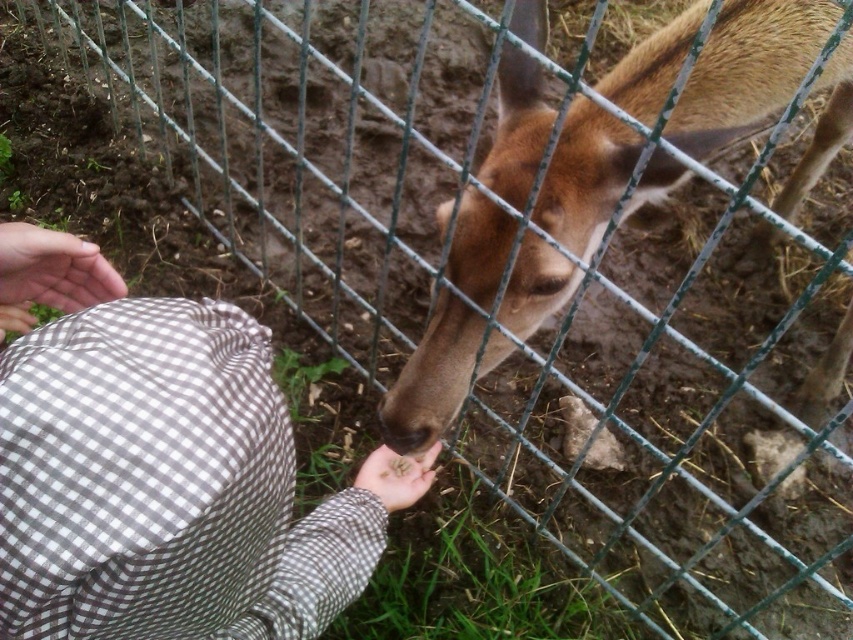
You are trying to determine which hand is wider between the smooth fabric hand at lower left and the smooth brown hand at lower center. Based on the scene, which one is wider?

The smooth brown hand at lower center is wider than the smooth fabric hand at lower left.

You are a photographer trying to capture the interaction between the smooth fabric hand at lower left and the smooth brown hand at lower center. Which hand is closer to the camera lens?

The smooth fabric hand at lower left is closer to the camera lens because it is positioned over the smooth brown hand at lower center, indicating it is in front.